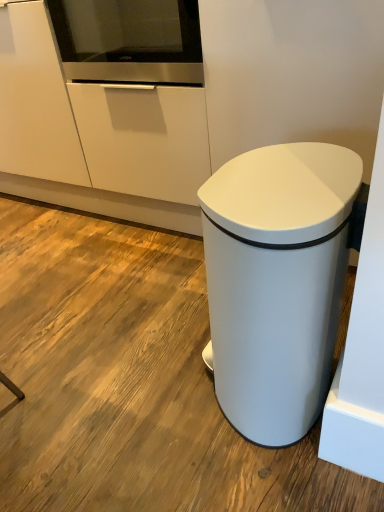
Question: In the image, is white matte waste container at lower right on the left side or the right side of stainless steel oven at upper center?

Choices:
 (A) right
 (B) left

Answer: (A)

Question: Does point (246, 435) appear closer or farther from the camera than point (165, 6)?

Choices:
 (A) farther
 (B) closer

Answer: (B)

Question: Looking at the image, does white matte waste container at lower right seem bigger or smaller compared to stainless steel oven at upper center?

Choices:
 (A) small
 (B) big

Answer: (B)

Question: From the image's perspective, is stainless steel oven at upper center above or below white matte waste container at lower right?

Choices:
 (A) above
 (B) below

Answer: (A)

Question: From a real-world perspective, relative to white matte waste container at lower right, is stainless steel oven at upper center vertically above or below?

Choices:
 (A) below
 (B) above

Answer: (B)

Question: Which is correct: stainless steel oven at upper center is inside white matte waste container at lower right, or outside of it?

Choices:
 (A) outside
 (B) inside

Answer: (A)

Question: Is stainless steel oven at upper center taller or shorter than white matte waste container at lower right?

Choices:
 (A) tall
 (B) short

Answer: (B)